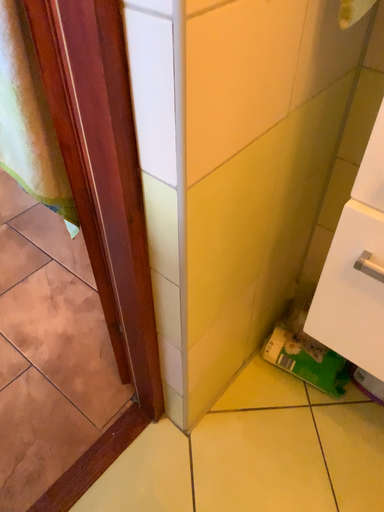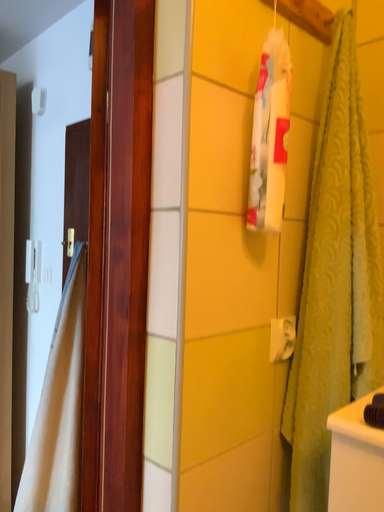
Question: Which way did the camera rotate in the video?

Choices:
 (A) rotated upward
 (B) rotated downward

Answer: (A)